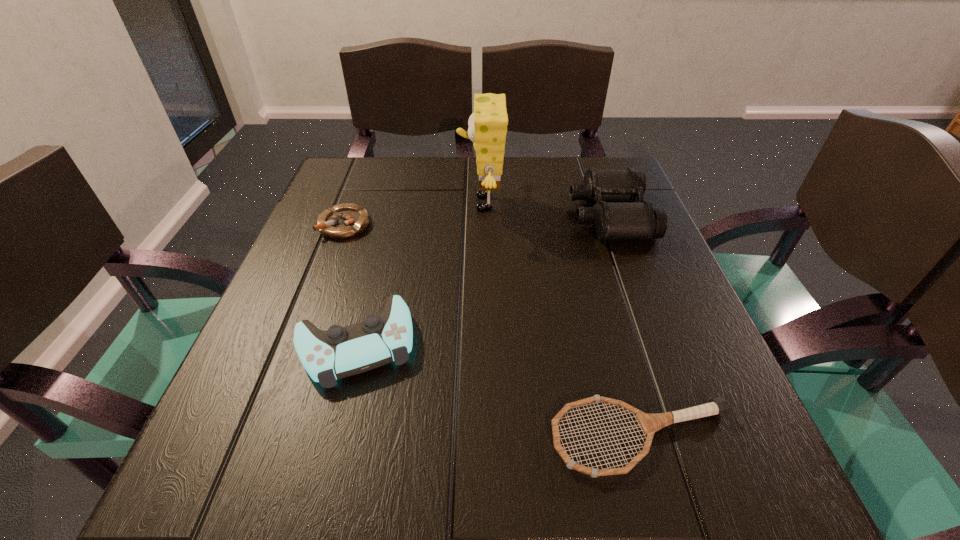
Find the location of a particular element. vacant space located 0.210m through the eyepieces of the binoculars is located at coordinates (478, 216).

Locate an element on the screen. The image size is (960, 540). free space located 0.270m through the eyepieces of the binoculars is located at coordinates pyautogui.click(x=452, y=216).

Where is `free location located through the eyepieces of the binoculars`? Image resolution: width=960 pixels, height=540 pixels. free location located through the eyepieces of the binoculars is located at coordinates (474, 216).

Find the location of `free space located 0.100m on the back of the control`. free space located 0.100m on the back of the control is located at coordinates (374, 268).

Locate an element on the screen. The image size is (960, 540). free space located on the right of the ashtray is located at coordinates (420, 225).

This screenshot has width=960, height=540. In order to click on vacant area situated 0.190m on the left of the tennis racket in this screenshot , I will do `click(413, 438)`.

Locate an element on the screen. The height and width of the screenshot is (540, 960). sponge positioned at the far edge is located at coordinates (487, 129).

This screenshot has width=960, height=540. What are the coordinates of `binoculars present at the far edge` in the screenshot? It's located at pyautogui.click(x=615, y=216).

Find the location of a particular element. This screenshot has width=960, height=540. object located in the near edge section of the desktop is located at coordinates (649, 423).

Find the location of `control positioned at the left edge`. control positioned at the left edge is located at coordinates (340, 352).